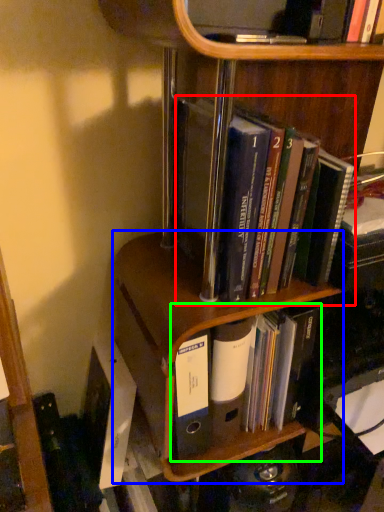
Question: Estimate the real-world distances between objects in this image. Which object is closer to book (highlighted by a red box), shelf (highlighted by a blue box) or book (highlighted by a green box)?

Choices:
 (A) shelf
 (B) book

Answer: (A)